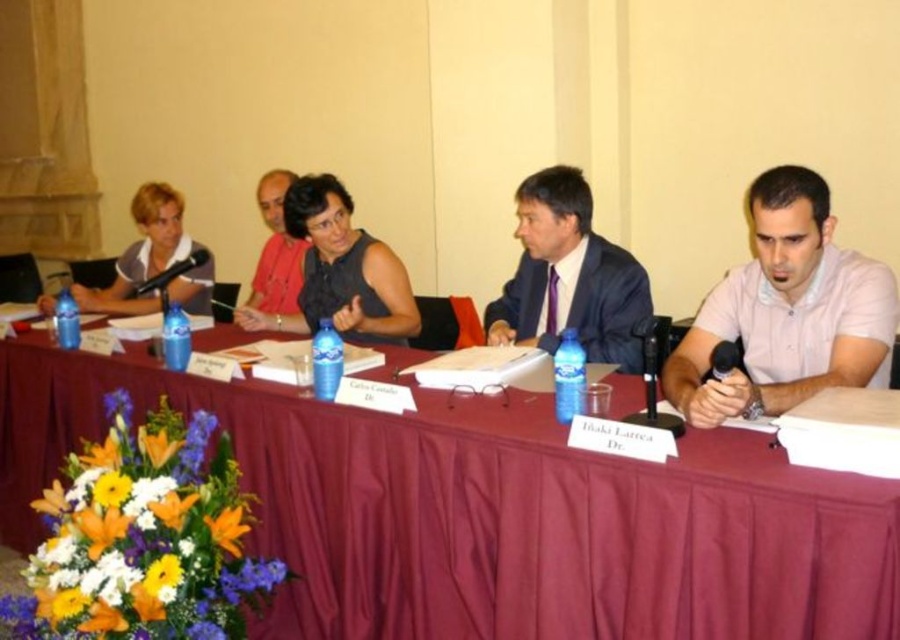
Is light pink cotton shirt at right in front of matte black shirt at left?

Yes, light pink cotton shirt at right is closer to the viewer.

Can you confirm if light pink cotton shirt at right is wider than matte black shirt at left?

No, light pink cotton shirt at right is not wider than matte black shirt at left.

Locate an element on the screen. The height and width of the screenshot is (640, 900). light pink cotton shirt at right is located at coordinates click(x=786, y=310).

The width and height of the screenshot is (900, 640). What are the coordinates of `light pink cotton shirt at right` in the screenshot? It's located at (786, 310).

Is maroon fabric table at center in front of matte black shirt at left?

Yes, it is.

Where is `maroon fabric table at center`? maroon fabric table at center is located at coordinates (488, 513).

Is maroon fabric table at center to the right of light pink cotton shirt at right from the viewer's perspective?

Incorrect, maroon fabric table at center is not on the right side of light pink cotton shirt at right.

Can you confirm if maroon fabric table at center is positioned above light pink cotton shirt at right?

Incorrect, maroon fabric table at center is not positioned above light pink cotton shirt at right.

Locate an element on the screen. The image size is (900, 640). maroon fabric table at center is located at coordinates (488, 513).